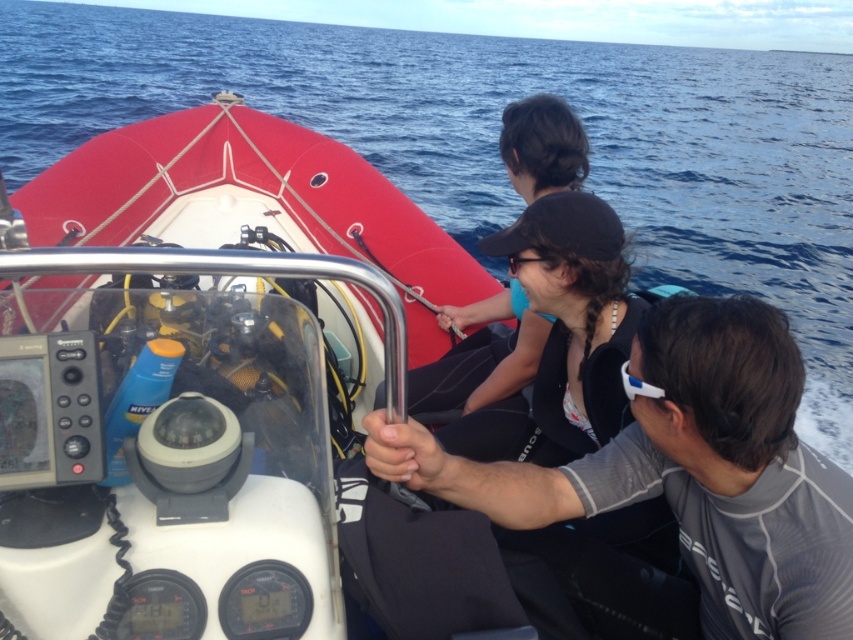
Can you confirm if blue water at center is positioned above gray matte wetsuit at center?

Indeed, blue water at center is positioned over gray matte wetsuit at center.

Where is `blue water at center`? The image size is (853, 640). blue water at center is located at coordinates coord(496,140).

This screenshot has width=853, height=640. What are the coordinates of `white matte boat at center` in the screenshot? It's located at (x=194, y=381).

Is white matte boat at center further to camera compared to black matte wetsuit at center?

Yes, white matte boat at center is further from the viewer.

Between point (73, 372) and point (456, 385), which one is positioned in front?

Point (73, 372) is more forward.

Find the location of a particular element. This screenshot has height=640, width=853. white matte boat at center is located at coordinates (194, 381).

Between point (387, 241) and point (753, 195), which one is positioned behind?

Positioned behind is point (753, 195).

The height and width of the screenshot is (640, 853). Find the location of `white matte boat at center`. white matte boat at center is located at coordinates click(194, 381).